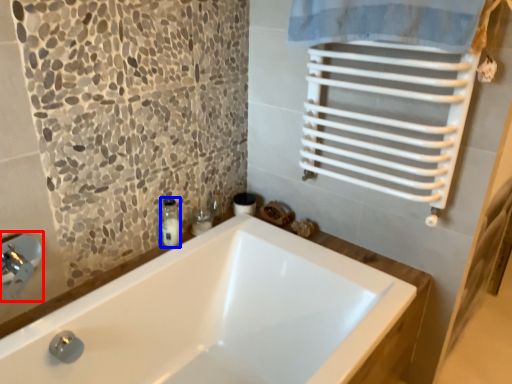
Question: Among these objects, which one is farthest to the camera, faucet (highlighted by a red box) or soap dispenser (highlighted by a blue box)?

Choices:
 (A) faucet
 (B) soap dispenser

Answer: (B)